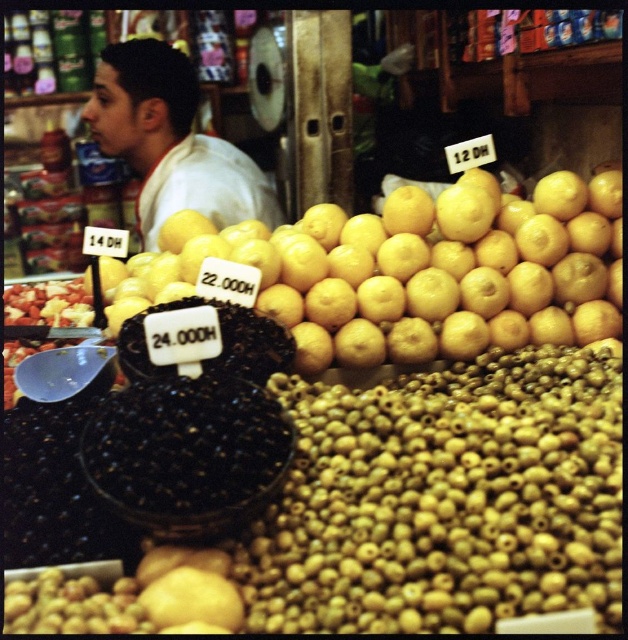
Please provide the exact coordinates of the yellow matte orange at center in the image. The coordinate system is defined as follows. The origin is at the bottom left corner of the image. The x axis is along the width of the image from left to right. The y axis is along the height of the image from bottom to top. The coordinates are normalized between 0 and 1. Please answer with the coordinates in the format of a tuple with two decimal numbers separated by a comma, like this example format answer format is 0

The coordinates of the yellow matte orange at center are at point (414, 272).

You are a customer at the market and want to buy the yellow matte orange at center and the white matte shirt at upper left. Which item is located to the right of the other?

The yellow matte orange at center is positioned on the right side of white matte shirt at upper left.